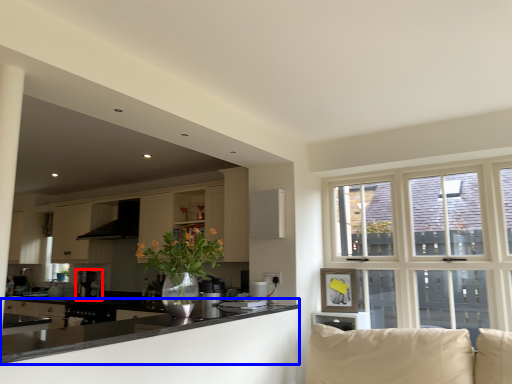
Question: Among these objects, which one is farthest to the camera, coffee machine (highlighted by a red box) or countertop (highlighted by a blue box)?

Choices:
 (A) coffee machine
 (B) countertop

Answer: (A)